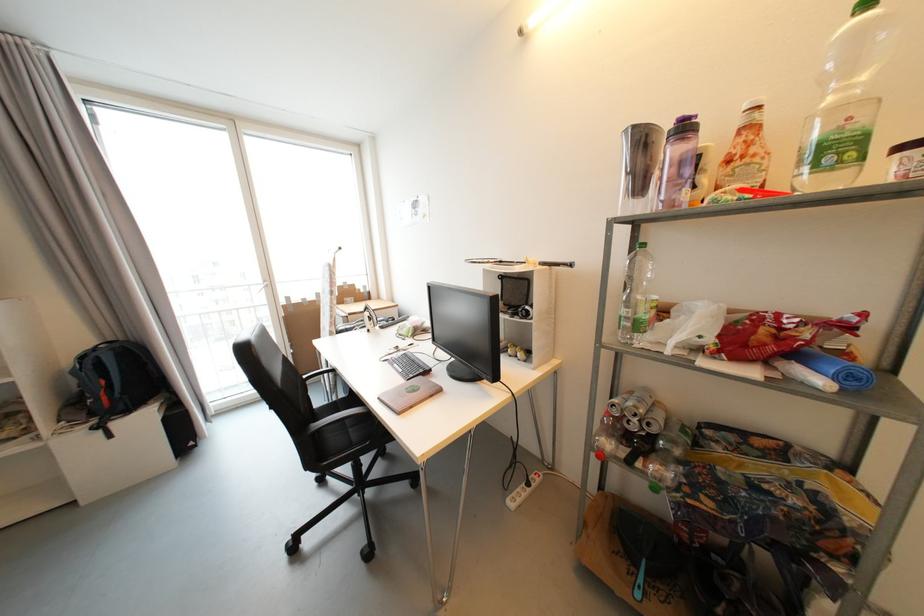
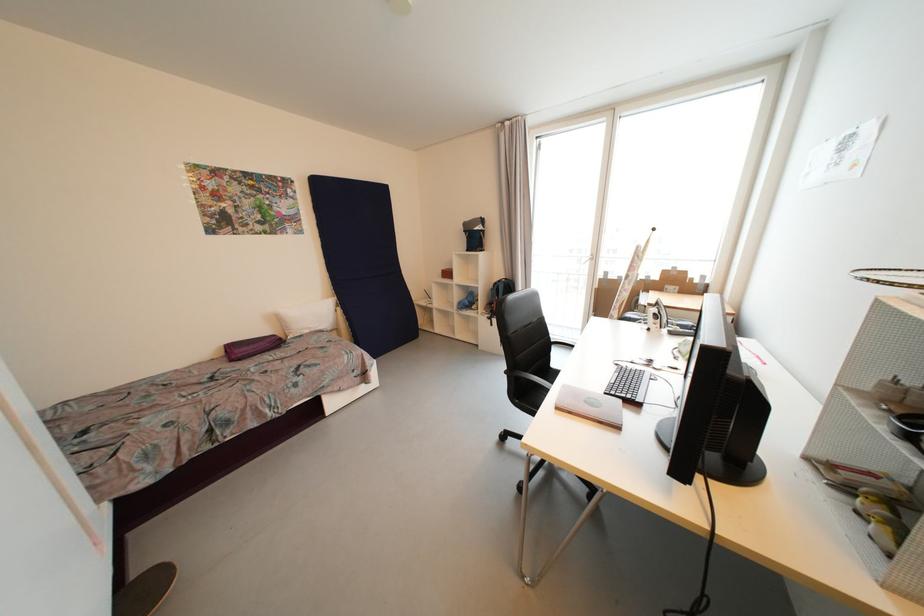
Find the pixel in the second image that matches (405,416) in the first image.

(562, 410)